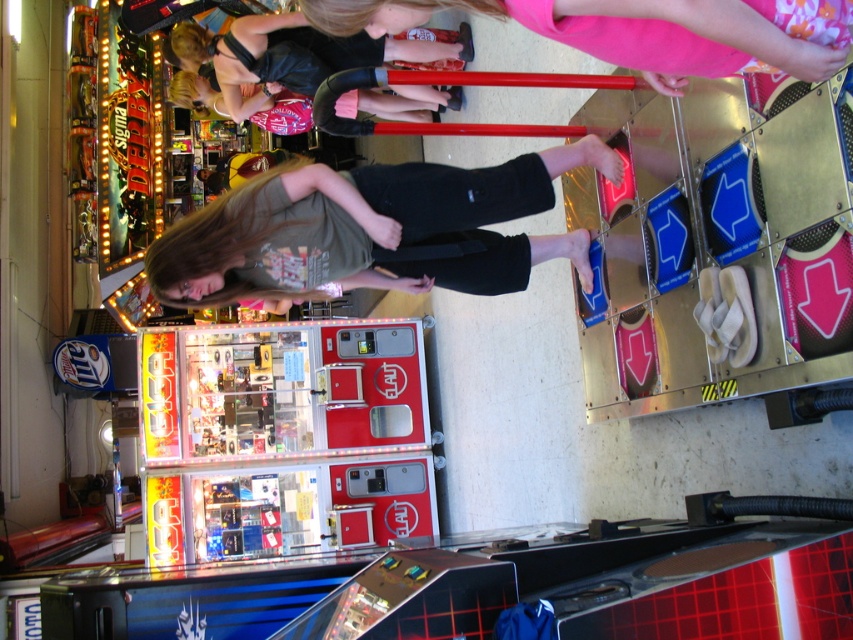
Can you confirm if green cotton shirt at center is taller than black leather jacket at upper center?

Yes.

Can you confirm if green cotton shirt at center is shorter than black leather jacket at upper center?

Incorrect, green cotton shirt at center's height does not fall short of black leather jacket at upper center's.

Is point (434, 282) positioned before point (245, 36)?

Yes.

At what (x,y) coordinates should I click in order to perform the action: click on green cotton shirt at center. Please return your answer as a coordinate pair (x, y). Looking at the image, I should click on (363, 227).

Can you confirm if matte black pants at center is wider than black leather jacket at upper center?

No.

In the scene shown: Between matte black pants at center and black leather jacket at upper center, which one has less height?

→ With less height is matte black pants at center.

You are a GUI agent. You are given a task and a screenshot of the screen. Output one action in this format:
    pyautogui.click(x=<x>, y=<y>)
    Task: Click on the matte black pants at center
    The image size is (853, 640).
    Given the screenshot: What is the action you would take?
    pyautogui.click(x=637, y=29)

The width and height of the screenshot is (853, 640). What are the coordinates of `matte black pants at center` in the screenshot? It's located at coord(637,29).

Is green cotton shirt at center further to camera compared to matte black pants at center?

Yes, it is behind matte black pants at center.

Can you confirm if green cotton shirt at center is shorter than matte black pants at center?

Incorrect, green cotton shirt at center's height does not fall short of matte black pants at center's.

Does point (209, 280) come closer to viewer compared to point (722, 38)?

No, (209, 280) is further to viewer.

The width and height of the screenshot is (853, 640). I want to click on green cotton shirt at center, so click(363, 227).